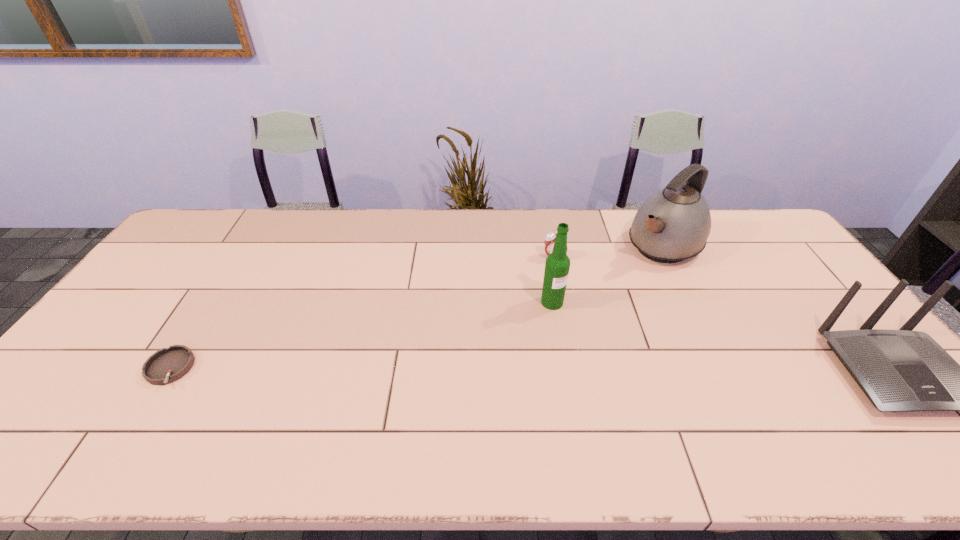
Locate an element on the screen. This screenshot has width=960, height=540. vacant space on the desktop that is between the shortest object and the third tallest object and is positioned on the label of the third nearest object is located at coordinates (635, 370).

The height and width of the screenshot is (540, 960). I want to click on vacant space on the desktop that is between the ashtray and the router and is positioned on the clock face of the alarm clock, so click(x=562, y=370).

This screenshot has height=540, width=960. I want to click on free space on the desktop that is between the ashtray and the router and is positioned at the spout of the kettle, so click(x=514, y=370).